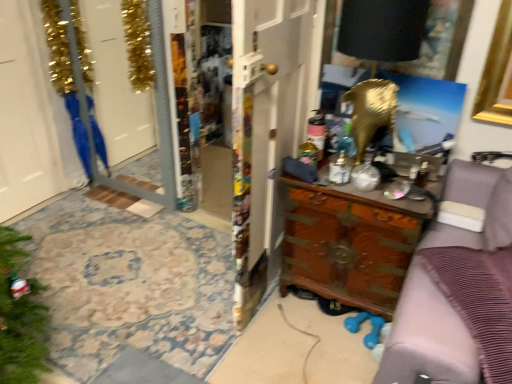
Question: Can we say brown wood dresser at right lies outside white glossy door at left, which is the 2th door from right to left?

Choices:
 (A) yes
 (B) no

Answer: (A)

Question: Considering the relative sizes of brown wood dresser at right and white glossy door at left, which is counted as the 1th door, starting from the left, in the image provided, is brown wood dresser at right shorter than white glossy door at left, which is counted as the 1th door, starting from the left,?

Choices:
 (A) yes
 (B) no

Answer: (A)

Question: Considering the relative positions of brown wood dresser at right and white glossy door at left, which is the 2th door from right to left, in the image provided, is brown wood dresser at right to the right of white glossy door at left, which is the 2th door from right to left, from the viewer's perspective?

Choices:
 (A) yes
 (B) no

Answer: (A)

Question: Are brown wood dresser at right and white glossy door at left, which is counted as the 1th door, starting from the left, located far from each other?

Choices:
 (A) yes
 (B) no

Answer: (A)

Question: Is brown wood dresser at right to the left of white glossy door at left, which is the 2th door from right to left, from the viewer's perspective?

Choices:
 (A) no
 (B) yes

Answer: (A)

Question: From a real-world perspective, relative to blue fabric robe at left, is black matte lamp at upper right vertically above or below?

Choices:
 (A) above
 (B) below

Answer: (A)

Question: In terms of width, does black matte lamp at upper right look wider or thinner when compared to blue fabric robe at left?

Choices:
 (A) thin
 (B) wide

Answer: (B)

Question: Choose the correct answer: Is black matte lamp at upper right inside blue fabric robe at left or outside it?

Choices:
 (A) inside
 (B) outside

Answer: (B)

Question: Would you say black matte lamp at upper right is to the left or to the right of blue fabric robe at left in the picture?

Choices:
 (A) left
 (B) right

Answer: (B)

Question: Is wooden carved dresser at center taller or shorter than black matte lamp at upper right?

Choices:
 (A) tall
 (B) short

Answer: (B)

Question: Is wooden carved dresser at center inside the boundaries of black matte lamp at upper right, or outside?

Choices:
 (A) inside
 (B) outside

Answer: (B)

Question: Is wooden carved dresser at center in front of or behind black matte lamp at upper right in the image?

Choices:
 (A) front
 (B) behind

Answer: (B)

Question: Considering the positions of wooden carved dresser at center and black matte lamp at upper right in the image, is wooden carved dresser at center wider or thinner than black matte lamp at upper right?

Choices:
 (A) wide
 (B) thin

Answer: (A)

Question: Looking at the image, does blue fabric robe at left seem bigger or smaller compared to brown wood dresser at right?

Choices:
 (A) small
 (B) big

Answer: (A)

Question: In the image, is blue fabric robe at left positioned in front of or behind brown wood dresser at right?

Choices:
 (A) behind
 (B) front

Answer: (A)